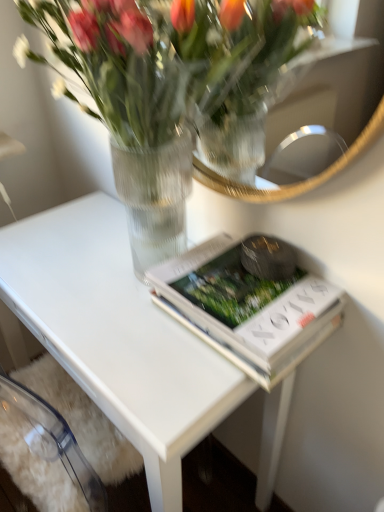
What are the coordinates of `vacant space that is to the left of white matte book at center` in the screenshot? It's located at pyautogui.click(x=119, y=316).